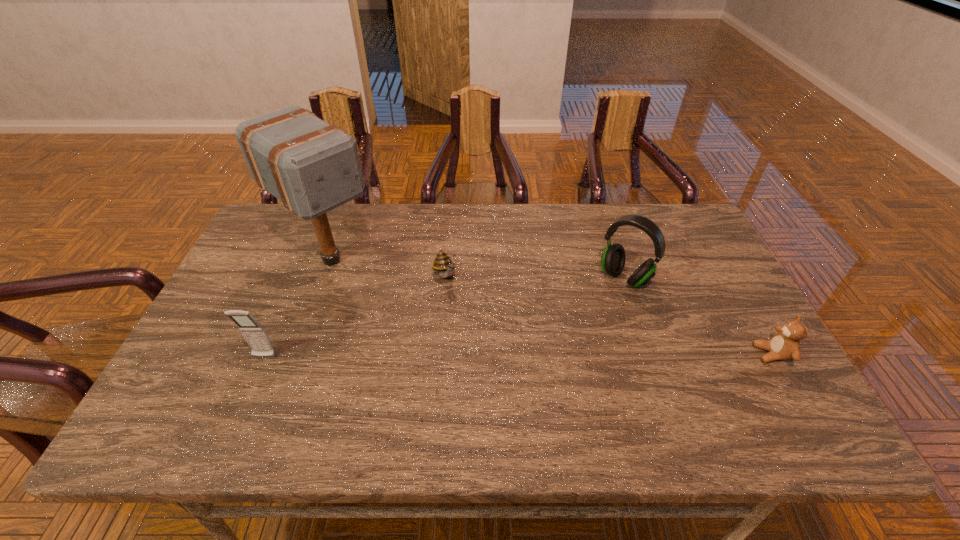
Locate an element on the screen. The image size is (960, 540). cellular telephone located in the left edge section of the desktop is located at coordinates (255, 335).

Identify the location of mallet located in the left edge section of the desktop. (311, 166).

This screenshot has height=540, width=960. What are the coordinates of `object that is at the right edge` in the screenshot? It's located at (785, 345).

Locate an element on the screen. object that is at the far left corner is located at coordinates [311, 166].

Locate an element on the screen. object present at the near right corner is located at coordinates (785, 345).

This screenshot has height=540, width=960. I want to click on vacant space at the far edge of the desktop, so click(x=558, y=212).

Locate an element on the screen. The image size is (960, 540). vacant area at the near edge of the desktop is located at coordinates (711, 391).

You are a GUI agent. You are given a task and a screenshot of the screen. Output one action in this format:
    pyautogui.click(x=<x>, y=<y>)
    Task: Click on the free space at the left edge
    The height and width of the screenshot is (540, 960).
    Given the screenshot: What is the action you would take?
    252,253

Where is `vacant space at the right edge of the desktop`? vacant space at the right edge of the desktop is located at coordinates (723, 346).

Identify the location of free space at the far left corner. (257, 243).